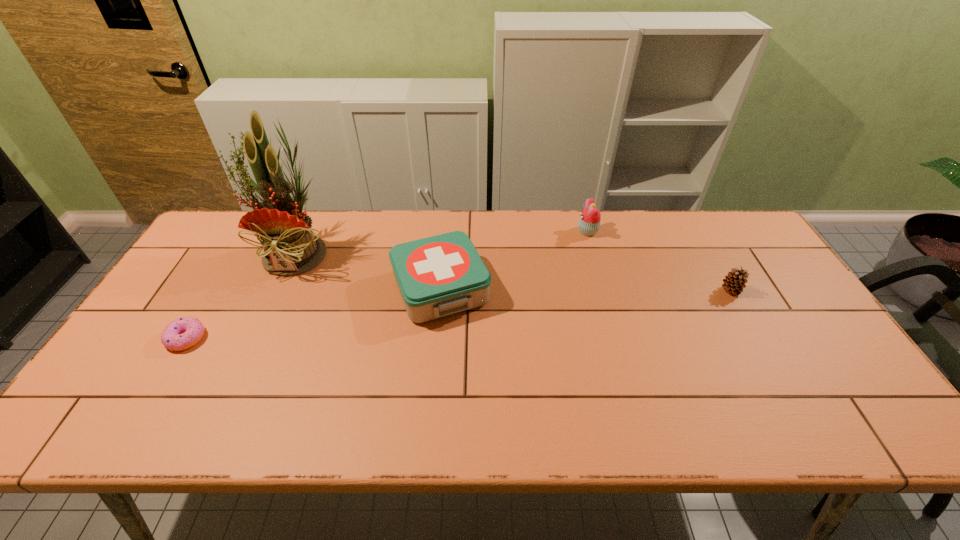
The height and width of the screenshot is (540, 960). Find the location of `vacant space at the left edge of the desktop`. vacant space at the left edge of the desktop is located at coordinates (203, 269).

What are the coordinates of `vacant point at the right edge` in the screenshot? It's located at (784, 284).

At what (x,y) coordinates should I click in order to perform the action: click on free area in between the third object from right to left and the leftmost object. Please return your answer as a coordinate pair (x, y). Looking at the image, I should click on (313, 313).

I want to click on free spot between the pinecone and the shortest object, so (458, 314).

Where is `free spot between the leftmost object and the cupcake`? The height and width of the screenshot is (540, 960). free spot between the leftmost object and the cupcake is located at coordinates (387, 285).

Where is `unoccupied position between the third object from right to left and the shortest object`? The image size is (960, 540). unoccupied position between the third object from right to left and the shortest object is located at coordinates (313, 313).

Where is `free space between the third object from right to left and the tallest object`? The width and height of the screenshot is (960, 540). free space between the third object from right to left and the tallest object is located at coordinates (370, 269).

Identify the location of blank region between the third object from left to right and the cupcake. The height and width of the screenshot is (540, 960). (515, 260).

The height and width of the screenshot is (540, 960). Find the location of `empty space that is in between the fourth object from left to right and the first-aid kit`. empty space that is in between the fourth object from left to right and the first-aid kit is located at coordinates (515, 260).

Image resolution: width=960 pixels, height=540 pixels. I want to click on free space between the pinecone and the cupcake, so click(660, 261).